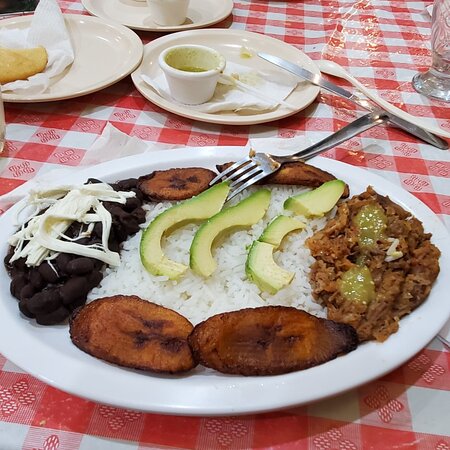
Where is `tablecloth`? Image resolution: width=450 pixels, height=450 pixels. tablecloth is located at coordinates (421, 406), (400, 158), (385, 58), (346, 82), (128, 118).